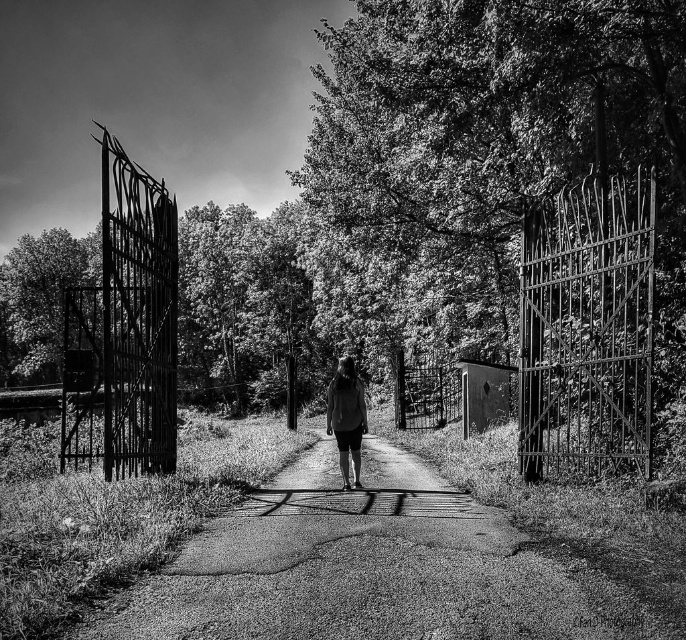
What do you see at coordinates (587, 328) in the screenshot? This screenshot has width=686, height=640. I see `rusty metal gate at right` at bounding box center [587, 328].

From the picture: Can you confirm if rusty metal gate at right is positioned below matte gray shirt at center?

Incorrect, rusty metal gate at right is not positioned below matte gray shirt at center.

What do you see at coordinates (587, 328) in the screenshot? This screenshot has height=640, width=686. I see `rusty metal gate at right` at bounding box center [587, 328].

Identify the location of rusty metal gate at right. (587, 328).

Who is taller, green leafy tree at center or smooth asphalt road at center?

green leafy tree at center is taller.

Does green leafy tree at center have a greater height compared to smooth asphalt road at center?

Indeed, green leafy tree at center has a greater height compared to smooth asphalt road at center.

What do you see at coordinates (528, 186) in the screenshot?
I see `green leafy tree at center` at bounding box center [528, 186].

You are a GUI agent. You are given a task and a screenshot of the screen. Output one action in this format:
    pyautogui.click(x=<x>, y=<y>)
    Task: Click on the green leafy tree at center
    
    Given the screenshot: What is the action you would take?
    pyautogui.click(x=528, y=186)

Between rusty metal gate at left and rustic wood door at center, which one is positioned lower?

Positioned lower is rustic wood door at center.

Where is `rusty metal gate at left`? This screenshot has height=640, width=686. rusty metal gate at left is located at coordinates (123, 332).